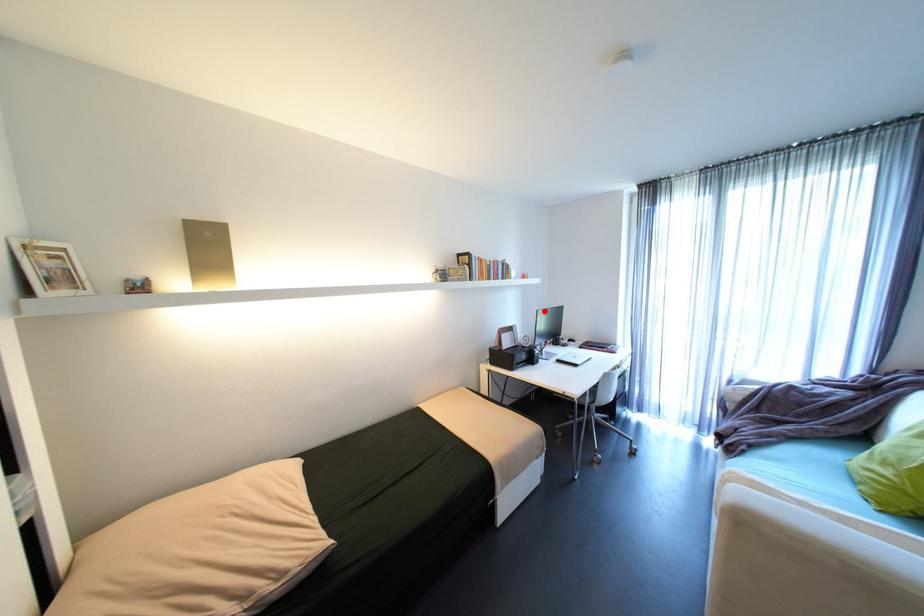
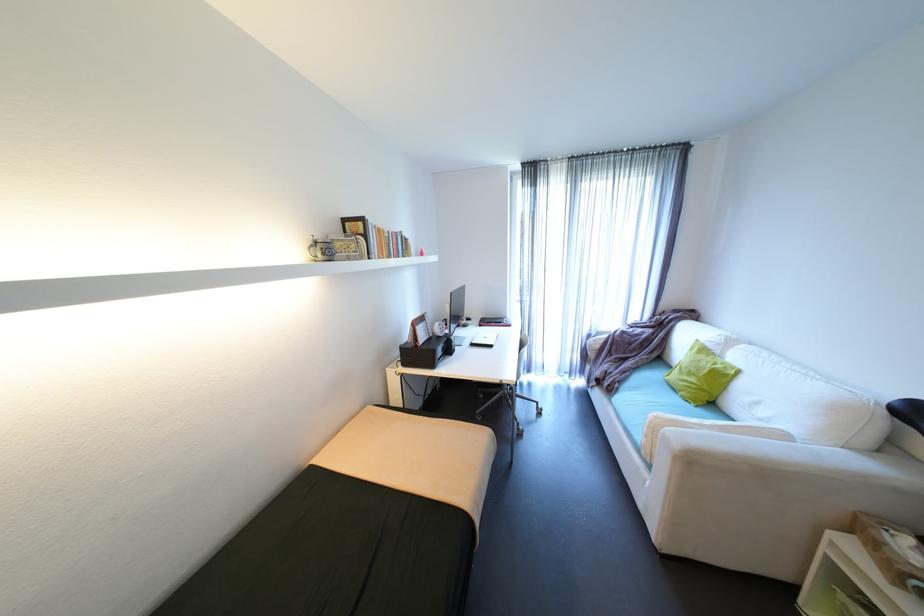
Where in the second image is the point corresponding to the highlighted location from the first image?

(458, 294)